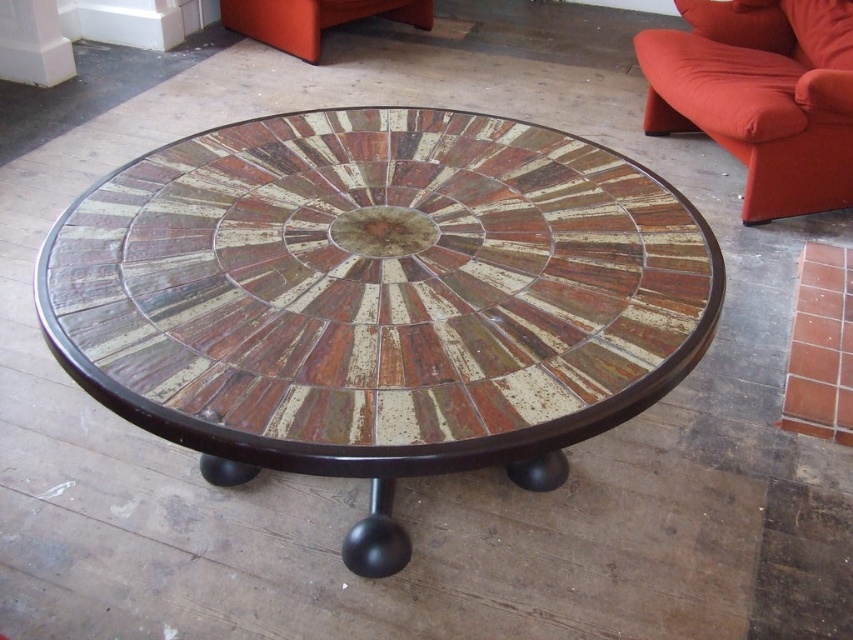
You are standing in the living room and want to place a 1.2 meter long rectangular coffee table on the floor where the wooden mosaic table at center is currently located. Is there enough space to fit the new table without moving any other furniture?

The wooden mosaic table at center is 1.04 meters from viewer. Since the new table is 1.2 meters long, it may not fit in the available space unless there is additional room around it. However, without information about the surrounding furniture or room dimensions, it is impossible to determine if there is enough space. Please check the layout and measurements of the room before deciding.

You are standing in the living room and see the wooden mosaic table at center. What is the exact location of the point marked at coordinates (379, 298) on the table?

The point marked at coordinates (379, 298) is located at the center of the wooden mosaic table at center.

In the scene shown: You are moving a 1.5 meter wide sofa into the living room. The velvet orange couch at right is already placed. Can you fit the new sofa next to the wooden mosaic table at center without overlapping?

The wooden mosaic table at center is 1.51 meters from the velvet orange couch at right. Since the new sofa is 1.5 meters wide, there is enough space between the wooden mosaic table at center and the velvet orange couch at right to fit the sofa without overlapping.